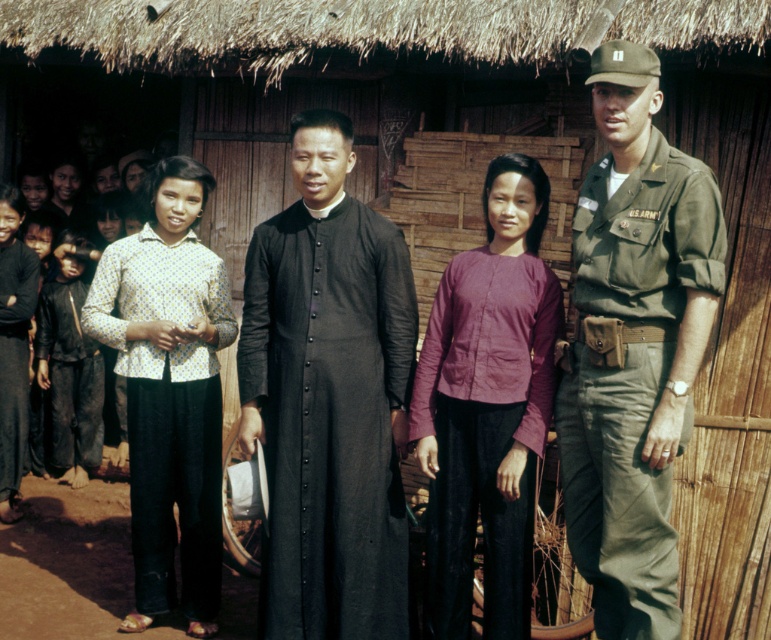
Who is taller, black matte robe at center or black matte pants at lower left?

Standing taller between the two is black matte robe at center.

Is black matte robe at center wider than black matte pants at lower left?

Indeed, black matte robe at center has a greater width compared to black matte pants at lower left.

Where is `black matte robe at center`? Image resolution: width=771 pixels, height=640 pixels. black matte robe at center is located at coordinates (328, 397).

Which of these two, purple cotton blouse at center or black matte pants at lower left, stands shorter?

With less height is black matte pants at lower left.

Who is more distant from viewer, (446, 365) or (32, 282)?

The point (32, 282) is more distant.

Locate an element on the screen. This screenshot has height=640, width=771. purple cotton blouse at center is located at coordinates (487, 406).

In the scene shown: Is yellow dotted shirt at left to the right of black matte pants at lower left from the viewer's perspective?

Correct, you'll find yellow dotted shirt at left to the right of black matte pants at lower left.

Does yellow dotted shirt at left lie behind black matte pants at lower left?

No.

The width and height of the screenshot is (771, 640). Describe the element at coordinates (169, 392) in the screenshot. I see `yellow dotted shirt at left` at that location.

You are a GUI agent. You are given a task and a screenshot of the screen. Output one action in this format:
    pyautogui.click(x=<x>, y=<y>)
    Task: Click on the yellow dotted shirt at left
    This screenshot has width=771, height=640.
    Given the screenshot: What is the action you would take?
    pyautogui.click(x=169, y=392)